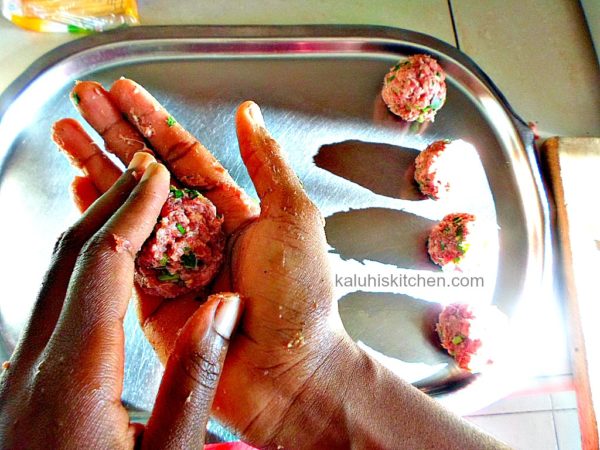
Find the location of `tray`. tray is located at coordinates (322, 198).